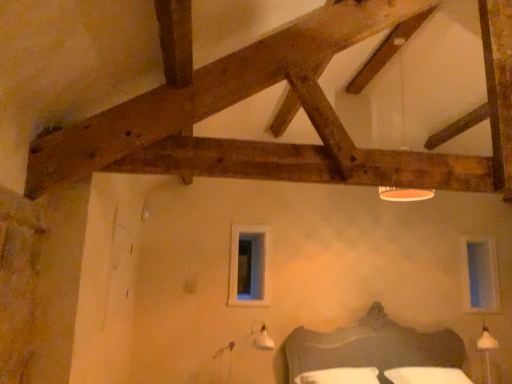
Question: Is white cotton bedding at lower center in front of or behind white plastic lampshade at upper center in the image?

Choices:
 (A) front
 (B) behind

Answer: (A)

Question: From a real-world perspective, is white cotton bedding at lower center physically located above or below white plastic lampshade at upper center?

Choices:
 (A) below
 (B) above

Answer: (A)

Question: Which object is the closest to the white plastic lampshade at upper center?

Choices:
 (A) white cotton bedding at lower center
 (B) clear glass window at center, which is counted as the 2th window, starting from the back
 (C) dark gray wooden bed at lower center
 (D) clear glass window at upper right, which appears as the first window when viewed from the right

Answer: (D)

Question: Based on their relative distances, which object is nearer to the white cotton bedding at lower center?

Choices:
 (A) clear glass window at center, which is counted as the 2th window, starting from the back
 (B) white plastic lampshade at upper center
 (C) dark gray wooden bed at lower center
 (D) clear glass window at upper right, which appears as the first window when viewed from the right

Answer: (C)